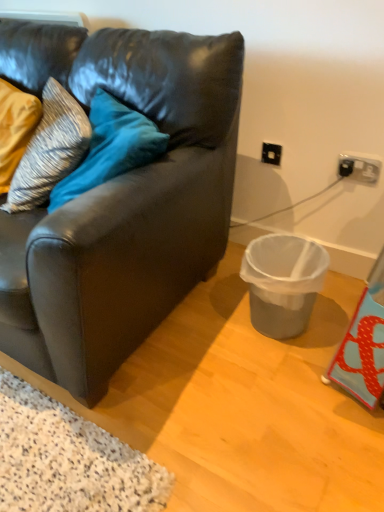
Find the location of `vacant point to the right of gray plastic trash can at lower right`. vacant point to the right of gray plastic trash can at lower right is located at coordinates (336, 304).